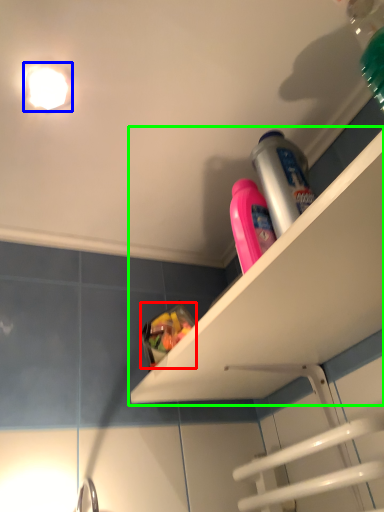
Question: Which object is the farthest from food (highlighted by a red box)? Choose among these: light fixture (highlighted by a blue box) or shelf (highlighted by a green box).

Choices:
 (A) light fixture
 (B) shelf

Answer: (A)